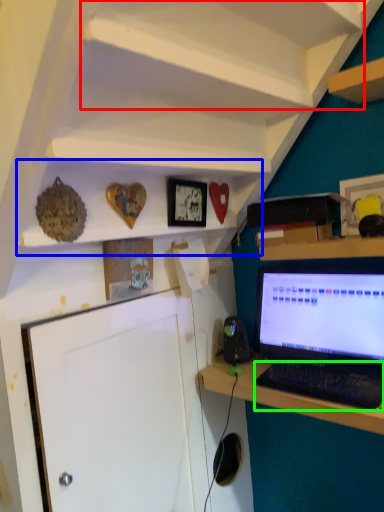
Question: Which object is the farthest from shelf (highlighted by a red box)? Choose among these: shelf (highlighted by a blue box) or computer keyboard (highlighted by a green box).

Choices:
 (A) shelf
 (B) computer keyboard

Answer: (B)